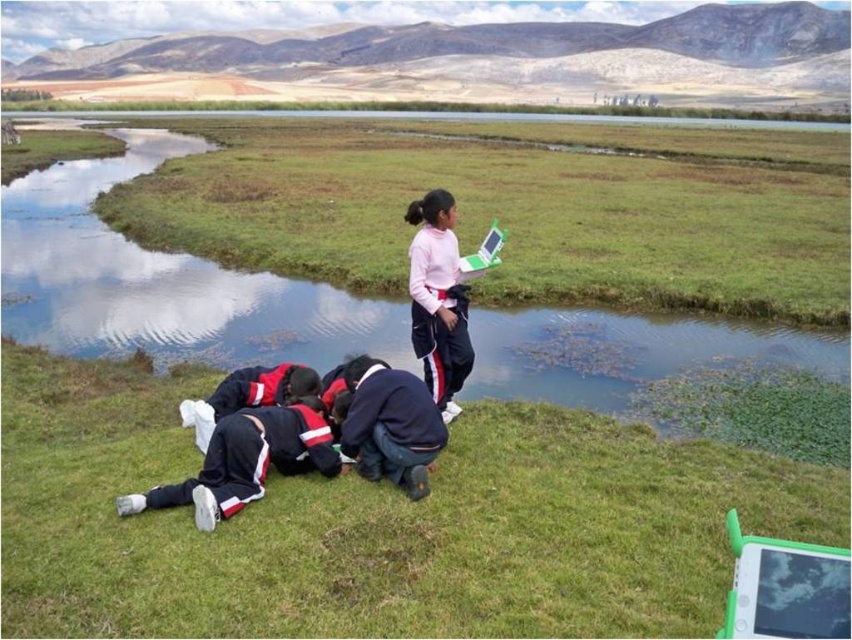
Question: Which point is closer to the camera?

Choices:
 (A) (79, 193)
 (B) (383, 374)
 (C) (446, 227)
 (D) (295, 516)

Answer: (D)

Question: Which is farther from the dark blue fabric pants at lower center?

Choices:
 (A) pink matte sweater at upper center
 (B) dark blue tracksuit at lower left
 (C) green plastic creek at center

Answer: (C)

Question: Is green plastic creek at center positioned before dark blue fabric pants at lower center?

Choices:
 (A) no
 (B) yes

Answer: (A)

Question: Is dark blue fabric pants at lower center below pink matte sweater at upper center?

Choices:
 (A) no
 (B) yes

Answer: (B)

Question: Is green plastic creek at center positioned in front of pink matte sweater at upper center?

Choices:
 (A) no
 (B) yes

Answer: (A)

Question: Which object is the farthest from the dark blue fabric pants at lower center?

Choices:
 (A) dark blue tracksuit at lower left
 (B) green plastic creek at center

Answer: (B)